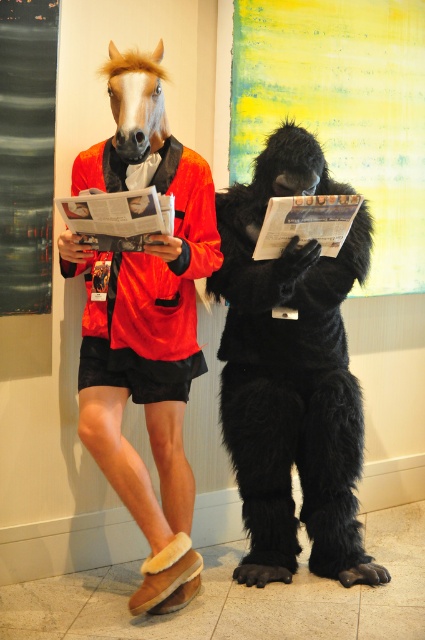
Question: Can you confirm if black furry gorilla at center is positioned above matte black horse mask at center?

Choices:
 (A) yes
 (B) no

Answer: (B)

Question: Based on their relative distances, which object is nearer to the matte black horse mask at center?

Choices:
 (A) matte black costume at left
 (B) black furry gorilla at center

Answer: (A)

Question: In this image, where is matte black costume at left located relative to matte black horse mask at center?

Choices:
 (A) above
 (B) below

Answer: (B)

Question: Which of the following is the closest to the observer?

Choices:
 (A) matte black costume at left
 (B) matte black horse mask at center
 (C) black furry gorilla at center

Answer: (A)

Question: Does black furry gorilla at center appear under matte black horse mask at center?

Choices:
 (A) no
 (B) yes

Answer: (B)

Question: Estimate the real-world distances between objects in this image. Which object is closer to the matte black costume at left?

Choices:
 (A) matte black horse mask at center
 (B) black furry gorilla at center

Answer: (A)